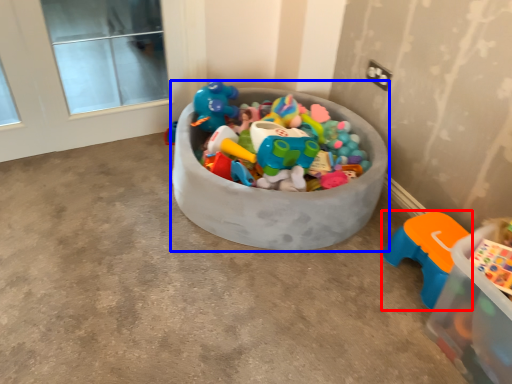
Question: Which point is further to the camera, toy (highlighted by a red box) or storage box (highlighted by a blue box)?

Choices:
 (A) toy
 (B) storage box

Answer: (A)